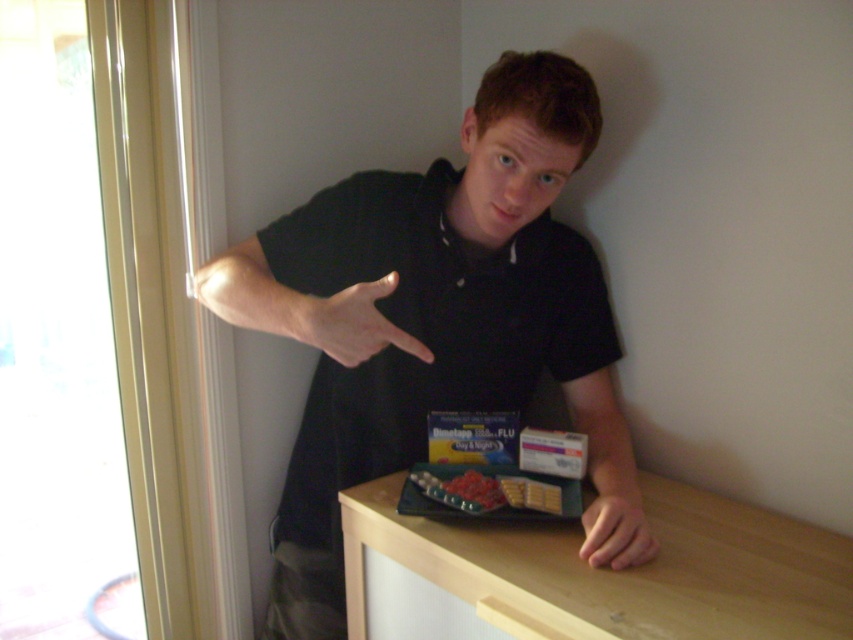
You are a photographer setting up a shoot in this room. You have a small prop that needs to be placed on the table. The prop is exactly the same size as the smooth skin hand at lower right. Can you fit the prop on the table without overlapping the black matte shirt at center?

The black matte shirt at center is larger in size than the smooth skin hand at lower right. Since the prop is the same size as the smooth skin hand at lower right, it would be smaller than the black matte shirt at center. However, the question is about fitting the prop on the table without overlapping the shirt. The scene description mentions the shirt is at the center of the table area, but the exact placement and space around it isn not specified. The table has a tray with items, so available space might

From the picture: You are a pharmacist assisting a customer at the counter. You notice the smooth skin hand at lower right and the bright red jelly beans at center. Which item is closer to you, the pharmacist?

The smooth skin hand at lower right is closer to the viewer than the bright red jelly beans at center, so the smooth skin hand at lower right is closer to you as the pharmacist.

You are a customer in a pharmacy and see the black matte shirt at center and the smooth skin hand at lower right. Which object is closer to the left side of the image?

The black matte shirt at center is closer to the left side of the image because it is positioned to the left of the smooth skin hand at lower right.